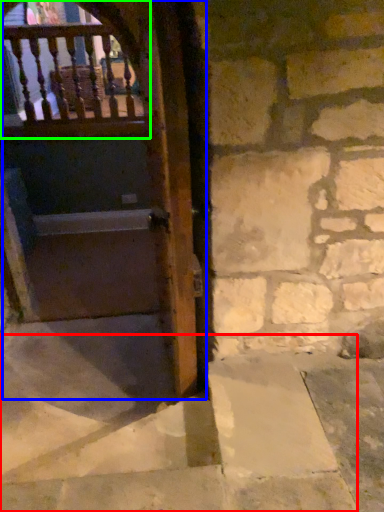
Question: Estimate the real-world distances between objects in this image. Which object is farther from stairwell (highlighted by a red box), door (highlighted by a blue box) or balcony (highlighted by a green box)?

Choices:
 (A) door
 (B) balcony

Answer: (B)